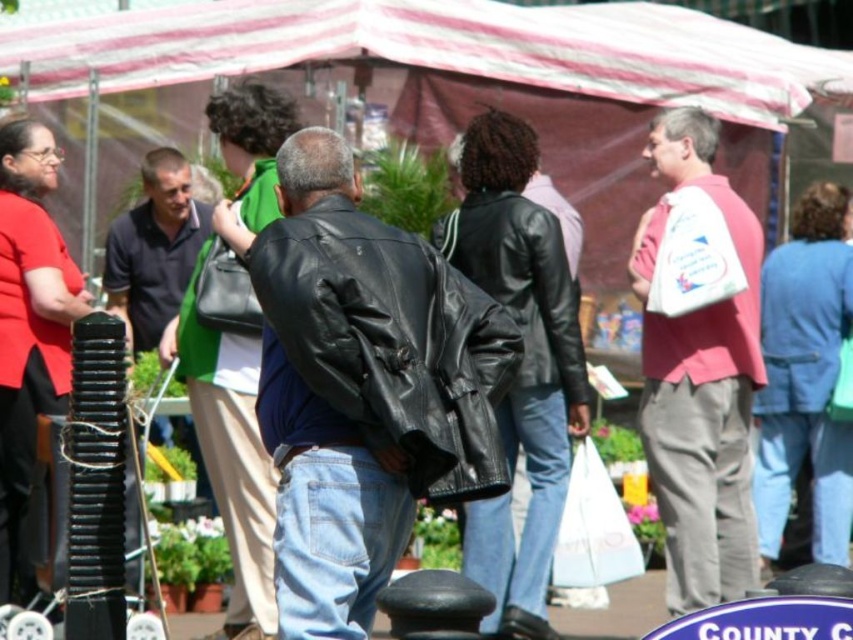
Question: Which object appears farthest from the camera in this image?

Choices:
 (A) white plastic bag at right
 (B) dark green fabric bag at center

Answer: (B)

Question: Is white plastic bag at right positioned in front of dark green fabric bag at center?

Choices:
 (A) no
 (B) yes

Answer: (B)

Question: Is shiny black leather jacket at center further to the viewer compared to dark green fabric bag at center?

Choices:
 (A) yes
 (B) no

Answer: (B)

Question: Which of these objects is positioned farthest from the shiny black leather jacket at center?

Choices:
 (A) white plastic bag at right
 (B) dark green fabric bag at center

Answer: (B)

Question: Which point appears farthest from the camera in this image?

Choices:
 (A) (140, 257)
 (B) (660, 362)

Answer: (A)

Question: Where is white plastic bag at right located in relation to dark green fabric bag at center in the image?

Choices:
 (A) left
 (B) right

Answer: (B)